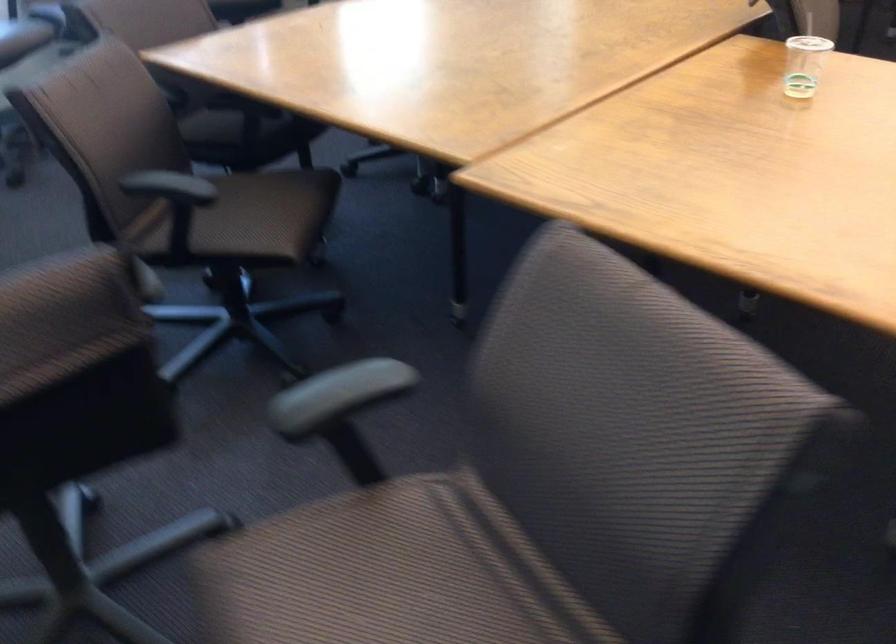
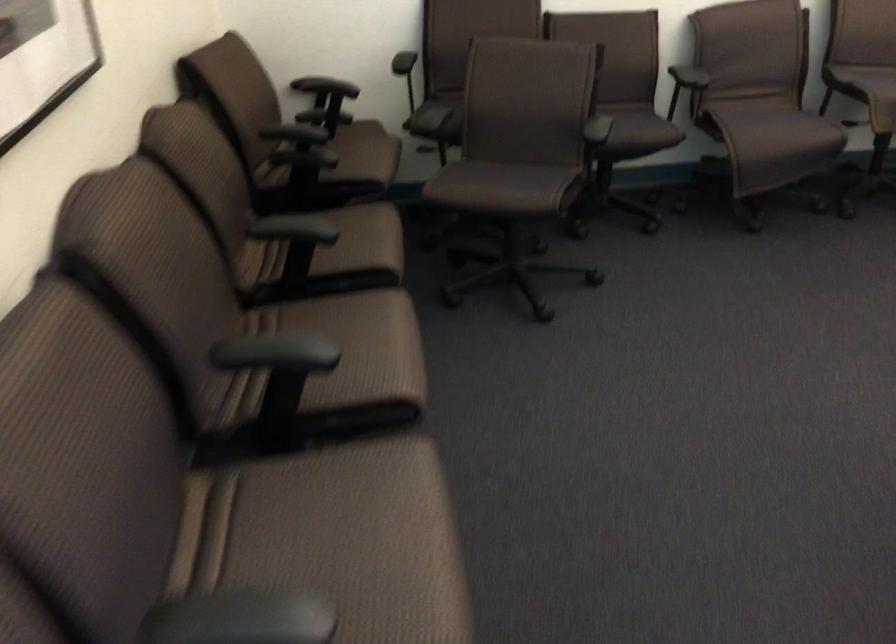
From the picture: The first image is from the beginning of the video and the second image is from the end. How did the camera likely rotate when shooting the video?

The camera's rotation is toward right-down.